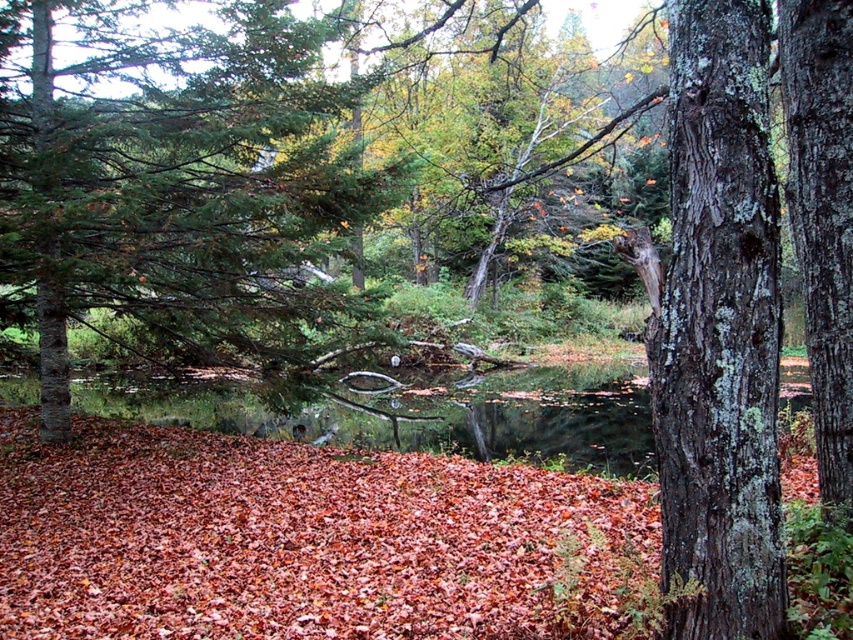
Question: Does autumn leaves at lower center appear over grayish-brown bark tree trunk at right?

Choices:
 (A) yes
 (B) no

Answer: (B)

Question: Which point is farther to the camera?

Choices:
 (A) (840, 424)
 (B) (122, 611)
 (C) (689, 433)

Answer: (B)

Question: Which object appears closest to the camera in this image?

Choices:
 (A) grayish-brown bark tree trunk at right
 (B) lichen-covered bark tree at center-right
 (C) autumn leaves at lower center

Answer: (A)

Question: Where is autumn leaves at lower center located in relation to lichen-covered bark tree at center-right in the image?

Choices:
 (A) below
 (B) above

Answer: (A)

Question: Estimate the real-world distances between objects in this image. Which object is closer to the autumn leaves at lower center?

Choices:
 (A) lichen-covered bark tree at center-right
 (B) grayish-brown bark tree trunk at right

Answer: (A)

Question: Observing the image, what is the correct spatial positioning of autumn leaves at lower center in reference to lichen-covered bark tree at center-right?

Choices:
 (A) right
 (B) left

Answer: (B)